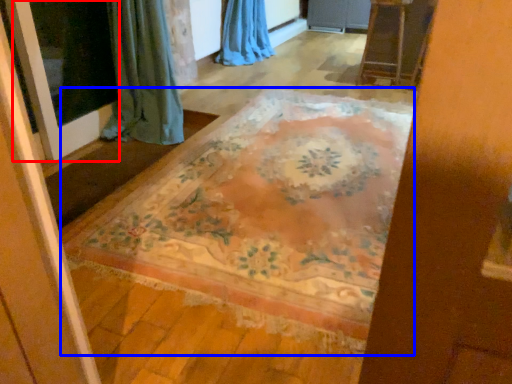
Question: Which object is closer to the camera taking this photo, screen door (highlighted by a red box) or mat (highlighted by a blue box)?

Choices:
 (A) screen door
 (B) mat

Answer: (B)